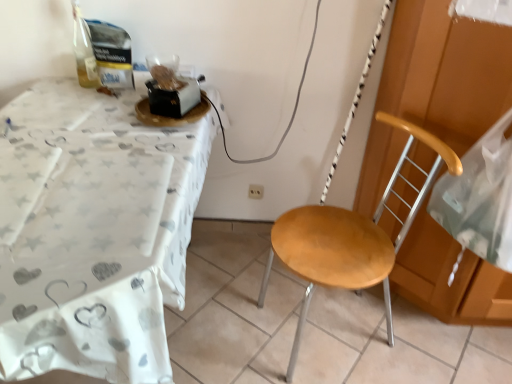
Measure the distance between white fabric table at left and camera.

The distance of white fabric table at left from camera is 28.26 inches.

The image size is (512, 384). I want to click on wooden seat at center, so click(350, 236).

Locate an element on the screen. This screenshot has width=512, height=384. transparent plastic bag at right is located at coordinates (480, 198).

Image resolution: width=512 pixels, height=384 pixels. I want to click on power outlet on the right of white fabric table at left, so click(256, 191).

From a real-world perspective, is white fabric table at left positioned over white plastic power outlet at center based on gravity?

Yes, from a real-world perspective, white fabric table at left is over white plastic power outlet at center

From the image's perspective, which is above, white fabric table at left or white plastic power outlet at center?

From the image's view, white plastic power outlet at center is above.

Is white fabric table at left with white plastic power outlet at center?

No, white fabric table at left is not touching white plastic power outlet at center.

From the image's perspective, which is below, transparent plastic bag at right or white plastic power outlet at center?

A: white plastic power outlet at center appears lower in the image.

Is transparent plastic bag at right thinner than white plastic power outlet at center?

Incorrect, the width of transparent plastic bag at right is not less than that of white plastic power outlet at center.

Is transparent plastic bag at right further to camera compared to white plastic power outlet at center?

No, transparent plastic bag at right is closer to the viewer.

Between white fabric table at left and transparent plastic bag at right, which one has more height?

transparent plastic bag at right is taller.

Which of these two, white fabric table at left or transparent plastic bag at right, is smaller?

transparent plastic bag at right.

Are white fabric table at left and transparent plastic bag at right beside each other?

No, white fabric table at left is not next to transparent plastic bag at right.

What's the angular difference between wooden seat at center and transparent plastic bag at right's facing directions?

The facing directions of wooden seat at center and transparent plastic bag at right are 72.7 degrees apart.

Can you confirm if wooden seat at center is bigger than transparent plastic bag at right?

Correct, wooden seat at center is larger in size than transparent plastic bag at right.

Is wooden seat at center next to transparent plastic bag at right and touching it?

No, wooden seat at center is not touching transparent plastic bag at right.

At what (x,y) coordinates should I click in order to perform the action: click on chair lying behind the white fabric table at left. Please return your answer as a coordinate pair (x, y). The image size is (512, 384). Looking at the image, I should click on pyautogui.click(x=350, y=236).

Considering the positions of objects wooden seat at center and white fabric table at left in the image provided, who is more to the left, wooden seat at center or white fabric table at left?

white fabric table at left is more to the left.

From the image's perspective, would you say wooden seat at center is shown under white fabric table at left?

Indeed, from the image's perspective, wooden seat at center is shown beneath white fabric table at left.

From a real-world perspective, between wooden seat at center and white fabric table at left, who is vertically lower?

A: wooden seat at center is physically lower.

In terms of size, does white fabric table at left appear bigger or smaller than wooden seat at center?

In the image, white fabric table at left appears to be larger than wooden seat at center.

In the scene shown: Does white fabric table at left appear on the right side of wooden seat at center?

In fact, white fabric table at left is to the left of wooden seat at center.

Is white fabric table at left far from wooden seat at center?

No, white fabric table at left is in close proximity to wooden seat at center.

Is point (149, 274) closer to camera compared to point (286, 232)?

Yes, point (149, 274) is closer to viewer.

Is white plastic power outlet at center at the left side of white fabric table at left?

A: No, white plastic power outlet at center is not to the left of white fabric table at left.

Can you confirm if white plastic power outlet at center is taller than white fabric table at left?

No, white plastic power outlet at center is not taller than white fabric table at left.

Consider the image. From the image's perspective, would you say white plastic power outlet at center is shown under white fabric table at left?

No.

Is white plastic power outlet at center facing away from white fabric table at left?

No, white plastic power outlet at center's orientation is not away from white fabric table at left.

You are a GUI agent. You are given a task and a screenshot of the screen. Output one action in this format:
    pyautogui.click(x=<x>, y=<y>)
    Task: Click on the desk that appears above the white plastic power outlet at center (from a real-world perspective)
    The width and height of the screenshot is (512, 384).
    Given the screenshot: What is the action you would take?
    pyautogui.click(x=93, y=232)

This screenshot has height=384, width=512. In order to click on power outlet lying behind the transparent plastic bag at right in this screenshot , I will do [x=256, y=191].

Which object lies further to the anchor point white plastic power outlet at center, white fabric table at left or wooden seat at center?

Among the two, white fabric table at left is located further to white plastic power outlet at center.

Based on their spatial positions, is transparent plastic bag at right or white fabric table at left closer to white plastic power outlet at center?

Among the two, white fabric table at left is located nearer to white plastic power outlet at center.

Looking at the image, which one is located closer to wooden seat at center, white plastic power outlet at center or white fabric table at left?

Among the two, white fabric table at left is located nearer to wooden seat at center.

Considering their positions, is white fabric table at left positioned further to transparent plastic bag at right than white plastic power outlet at center?

white fabric table at left is further to transparent plastic bag at right.

Which object lies nearer to the anchor point white plastic power outlet at center, white fabric table at left or transparent plastic bag at right?

The object closer to white plastic power outlet at center is white fabric table at left.

Which object lies further to the anchor point wooden seat at center, transparent plastic bag at right or white fabric table at left?

white fabric table at left lies further to wooden seat at center than the other object.

Estimate the real-world distances between objects in this image. Which object is closer to white plastic power outlet at center, transparent plastic bag at right or wooden seat at center?

Based on the image, wooden seat at center appears to be nearer to white plastic power outlet at center.

Based on their spatial positions, is white plastic power outlet at center or transparent plastic bag at right further from wooden seat at center?

white plastic power outlet at center is further to wooden seat at center.

Locate an element on the screen. chair between white fabric table at left and white plastic power outlet at center from front to back is located at coordinates (350, 236).

You are a GUI agent. You are given a task and a screenshot of the screen. Output one action in this format:
    pyautogui.click(x=<x>, y=<y>)
    Task: Click on the chair located between transparent plastic bag at right and white plastic power outlet at center in the depth direction
    The image size is (512, 384).
    Given the screenshot: What is the action you would take?
    pyautogui.click(x=350, y=236)

Where is `chair located between white fabric table at left and transparent plastic bag at right in the left-right direction`? The height and width of the screenshot is (384, 512). chair located between white fabric table at left and transparent plastic bag at right in the left-right direction is located at coordinates (350, 236).

Identify the location of sheet between white fabric table at left and white plastic power outlet at center in the front-back direction. [480, 198].